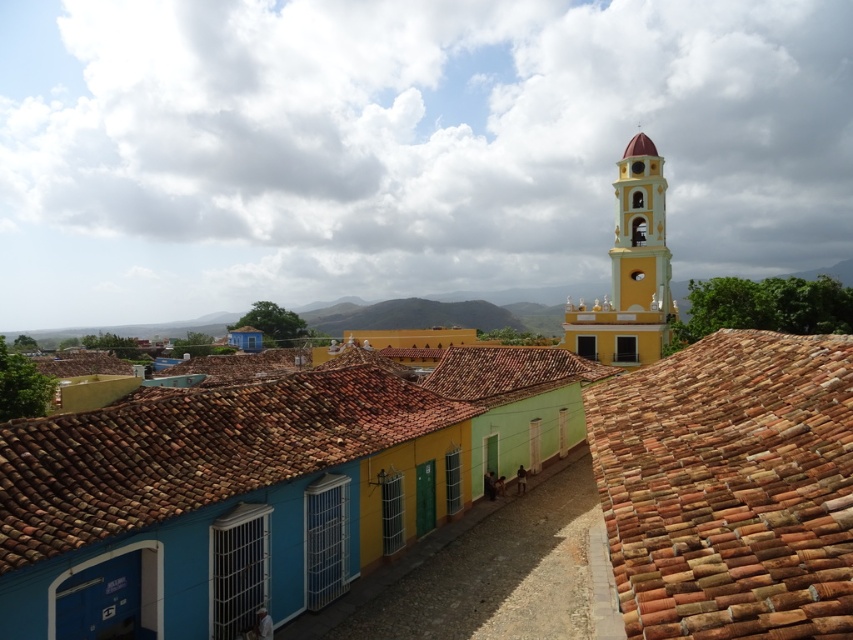
Question: Considering the real-world distances, which object is closest to the yellow matte bell tower at upper right?

Choices:
 (A) yellow matte church at upper center
 (B) yellow matte tower at upper right
 (C) terracotta tiles at right

Answer: (B)

Question: Which object is closer to the camera taking this photo?

Choices:
 (A) yellow matte tower at upper right
 (B) terracotta tiles at right
 (C) yellow matte church at upper center
 (D) yellow matte bell tower at upper right

Answer: (B)

Question: Which of these objects is positioned closest to the yellow matte church at upper center?

Choices:
 (A) yellow matte tower at upper right
 (B) yellow matte bell tower at upper right

Answer: (A)

Question: Can you confirm if yellow matte church at upper center is wider than terracotta tiles at right?

Choices:
 (A) no
 (B) yes

Answer: (B)

Question: Is terracotta tiles at right bigger than yellow matte bell tower at upper right?

Choices:
 (A) yes
 (B) no

Answer: (B)

Question: Observing the image, what is the correct spatial positioning of yellow matte church at upper center in reference to terracotta tiles at right?

Choices:
 (A) left
 (B) right

Answer: (A)